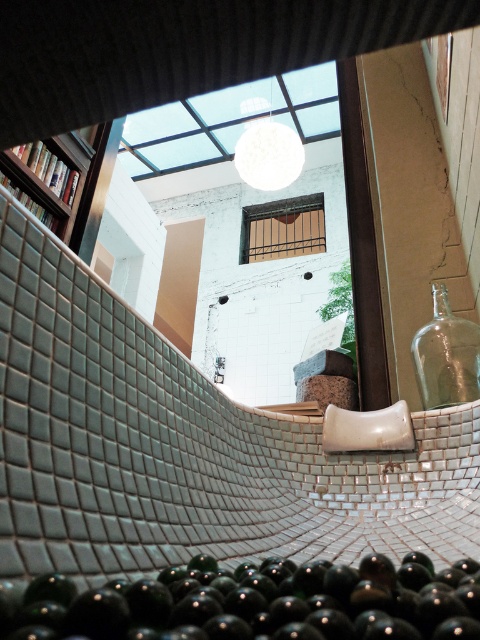
You are a delivery person who needs to place a new bottle that is 1.2 meters long between the green glass bottle at bottom and the transparent glass bottle at right. Can you fit it there without overlapping either bottle?

The distance between the green glass bottle at bottom and the transparent glass bottle at right is 1.12 meters. Since the new bottle is 1.2 meters long, it cannot fit between them without overlapping either bottle.

Looking at this image, you are a delivery person who needs to place a 2.5 meter long ladder between the green glass bottle at bottom and the wooden bookshelf at upper left. Can the ladder fit between them without being angled?

The distance between the green glass bottle at bottom and the wooden bookshelf at upper left is 2.47 meters. Since the ladder is 2.5 meters long, it cannot fit straight between them as it is slightly longer than the available space.